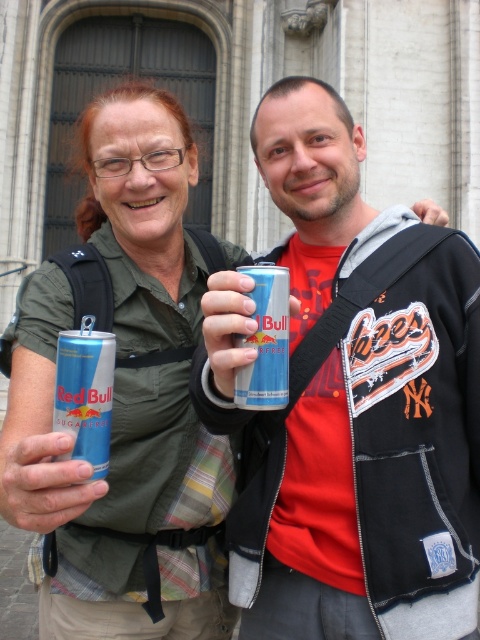
You are a photographer trying to capture a clear shot of the metallic blue can at lower left. However, the matte black sweatshirt at left is blocking your view. Can you move the can to the front without moving the sweatshirt?

The metallic blue can at lower left is behind the matte black sweatshirt at left, so moving the can to the front would require physically adjusting its position relative to the sweatshirt.